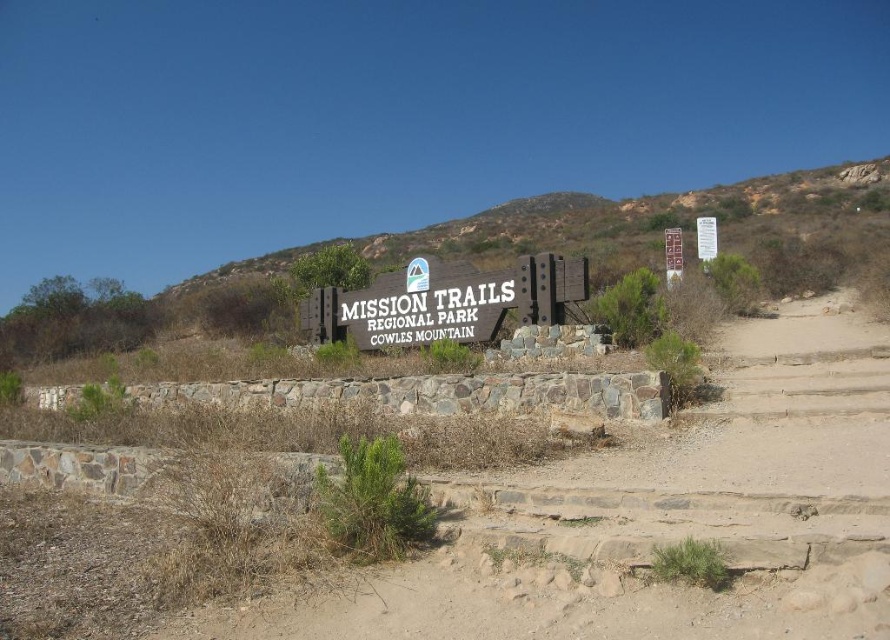
You are a hiker who wants to read both the wooden sign at center and the white paper sign at upper center. Which sign should you stand closer to in order to read its text clearly?

The wooden sign at center has a smaller size compared to the white paper sign at upper center, so you should stand closer to the wooden sign at center to read its text clearly.

Looking at this image, you are a park ranger checking the signage at Mission Trails Regional Park. You need to determine which wooden sign is wider. Which one has a greater width between the wooden sign at center and the wooden sign at upper right?

The wooden sign at center has a greater width than the wooden sign at upper right.